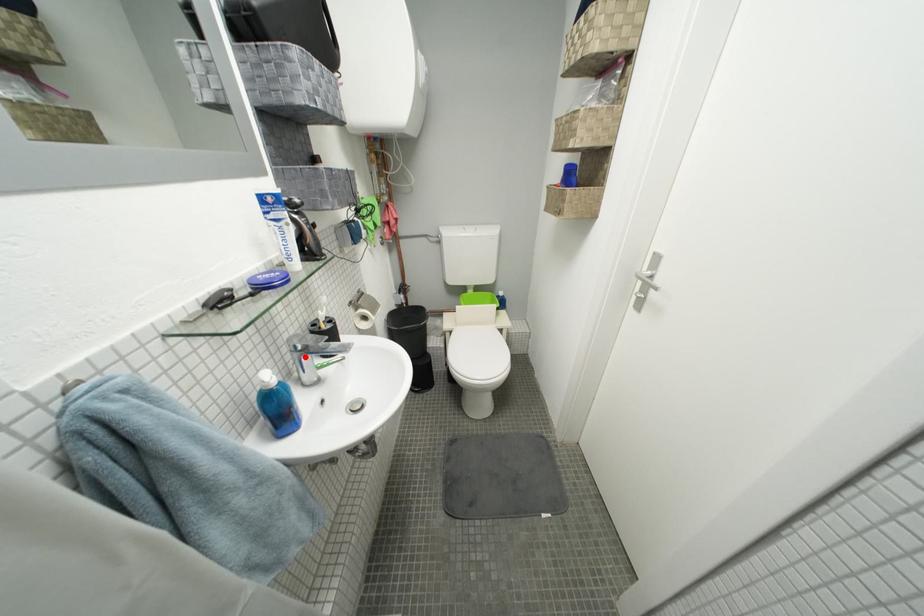
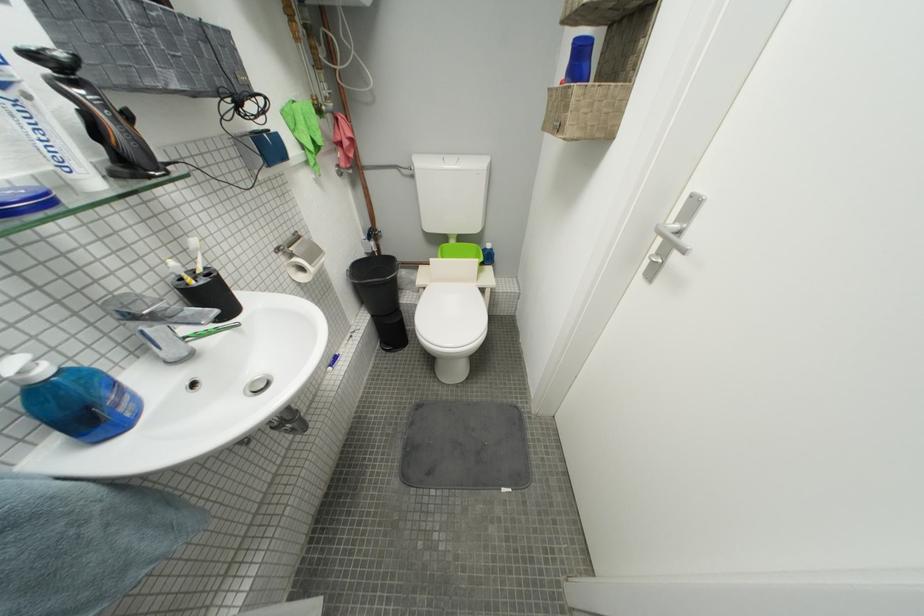
Where in the second image is the point corresponding to the highlighted location from the first image?

(139, 325)